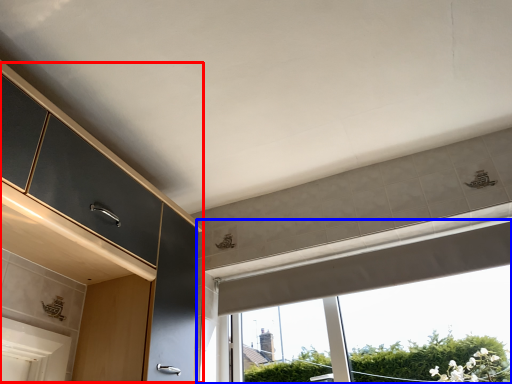
Question: Among these objects, which one is farthest to the camera, dresser (highlighted by a red box) or window (highlighted by a blue box)?

Choices:
 (A) dresser
 (B) window

Answer: (B)